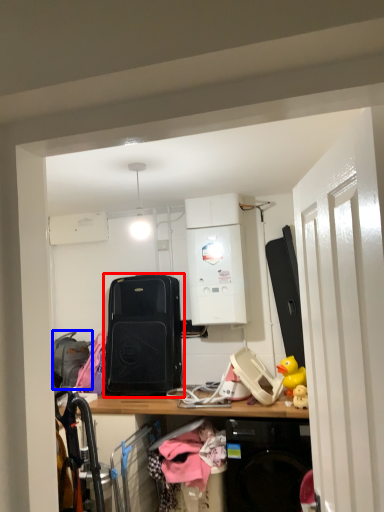
Question: Which of the following is the closest to the observer, luggage and bags (highlighted by a red box) or luggage (highlighted by a blue box)?

Choices:
 (A) luggage and bags
 (B) luggage

Answer: (A)